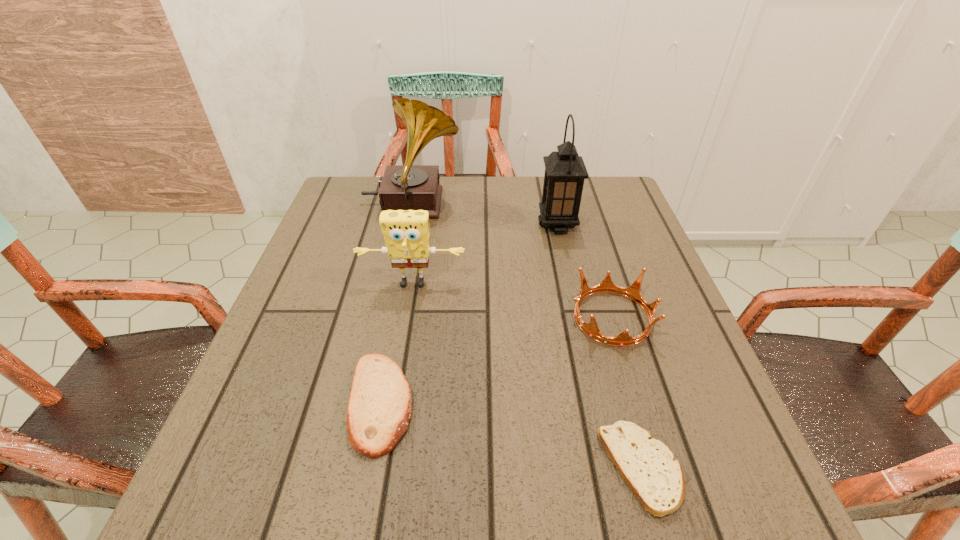
Find the location of `object that is the fourth closest to the taller pita bread`. object that is the fourth closest to the taller pita bread is located at coordinates (404, 187).

Identify which object is the second nearest to the phonograph record. Please provide its 2D coordinates. Your answer should be formatted as a tuple, i.e. [(x, y)], where the tuple contains the x and y coordinates of a point satisfying the conditions above.

[(565, 171)]

Find the location of a particular element. Image resolution: width=960 pixels, height=540 pixels. vacant space that satisfies the following two spatial constraints: 1. on the face of the shortest object; 2. on the right side of the sponge is located at coordinates (382, 468).

You are a GUI agent. You are given a task and a screenshot of the screen. Output one action in this format:
    pyautogui.click(x=<x>, y=<y>)
    Task: Click on the free region that satisfies the following two spatial constraints: 1. on the face of the right pita bread; 2. on the right side of the fourth shortest object
    Image resolution: width=960 pixels, height=540 pixels.
    Given the screenshot: What is the action you would take?
    pyautogui.click(x=382, y=468)

What are the coordinates of `vacant region that satisfies the following two spatial constraints: 1. on the face of the third tallest object; 2. on the right side of the right pita bread` in the screenshot? It's located at (382, 468).

Find the location of a particular element. free space that satisfies the following two spatial constraints: 1. on the face of the shortest object; 2. on the right side of the sponge is located at coordinates (382, 468).

At what (x,y) coordinates should I click in order to perform the action: click on vacant space that satisfies the following two spatial constraints: 1. from the horn of the lantern; 2. on the right side of the phonograph record. Please return your answer as a coordinate pair (x, y). Looking at the image, I should click on (408, 225).

Where is `free space that satisfies the following two spatial constraints: 1. from the horn of the lantern; 2. on the right side of the phonograph record`? The image size is (960, 540). free space that satisfies the following two spatial constraints: 1. from the horn of the lantern; 2. on the right side of the phonograph record is located at coordinates (408, 225).

The height and width of the screenshot is (540, 960). In order to click on blank space that satisfies the following two spatial constraints: 1. on the face of the right pita bread; 2. on the right side of the sponge in this screenshot , I will do `click(382, 468)`.

Locate an element on the screen. Image resolution: width=960 pixels, height=540 pixels. free space that satisfies the following two spatial constraints: 1. on the front side of the crown; 2. on the right side of the lantern is located at coordinates (578, 317).